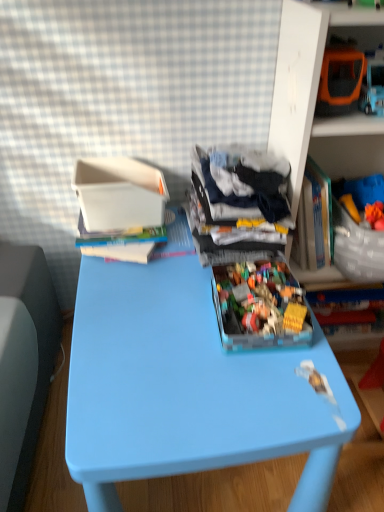
This screenshot has height=512, width=384. What are the coordinates of `free point above blue plastic table at center (from a real-world perspective)` in the screenshot? It's located at (177, 320).